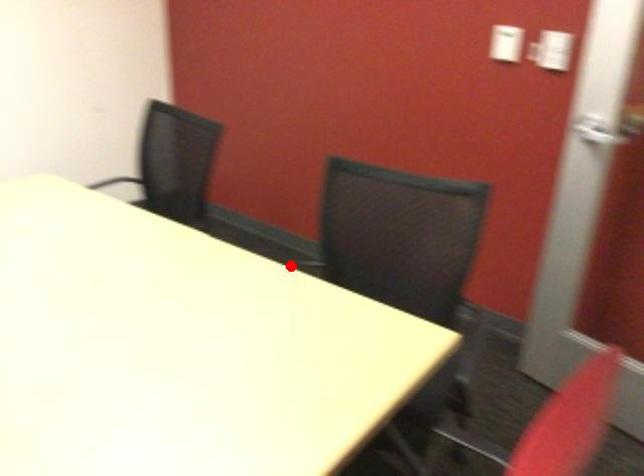
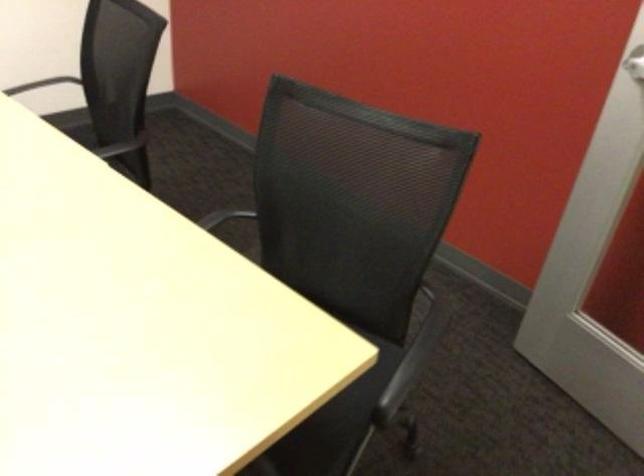
The point at the highlighted location is marked in the first image. Where is the corresponding point in the second image?

(223, 217)